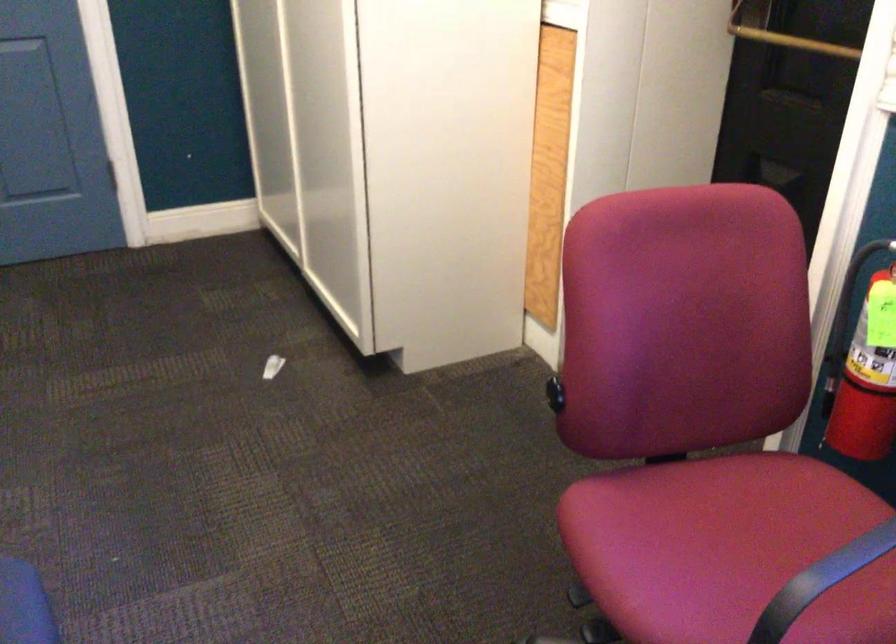
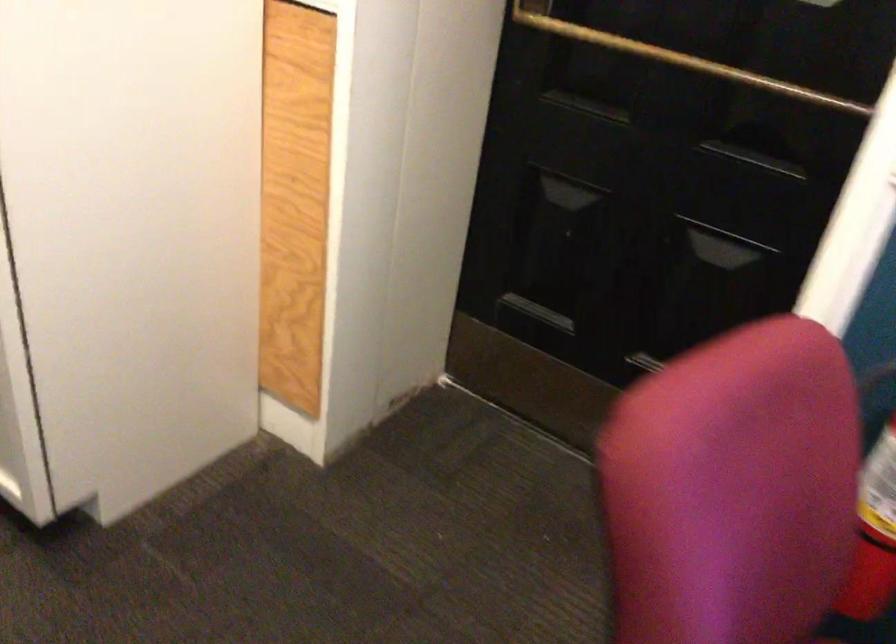
Question: The first image is from the beginning of the video and the second image is from the end. How did the camera likely rotate when shooting the video?

Choices:
 (A) Left
 (B) Right
 (C) Up
 (D) Down

Answer: (B)